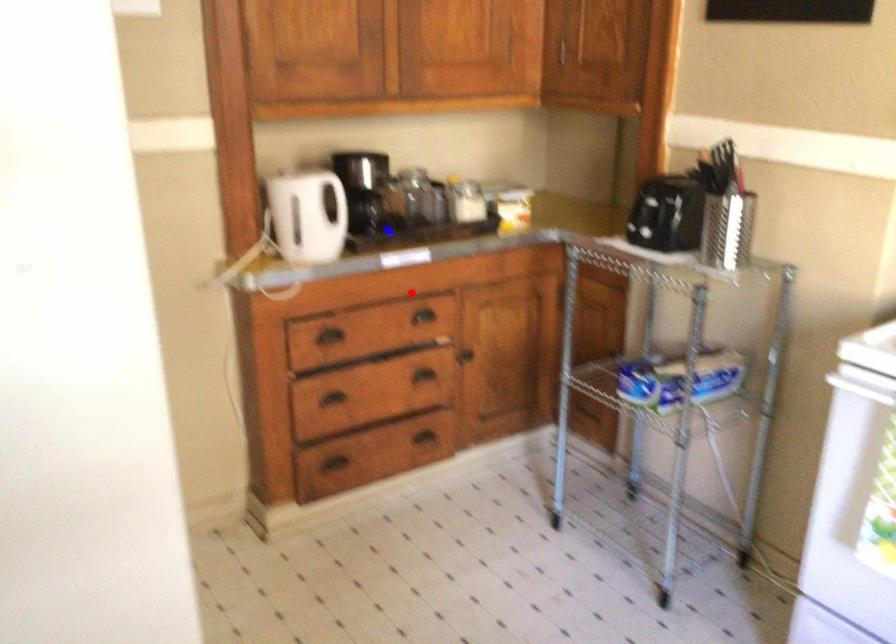
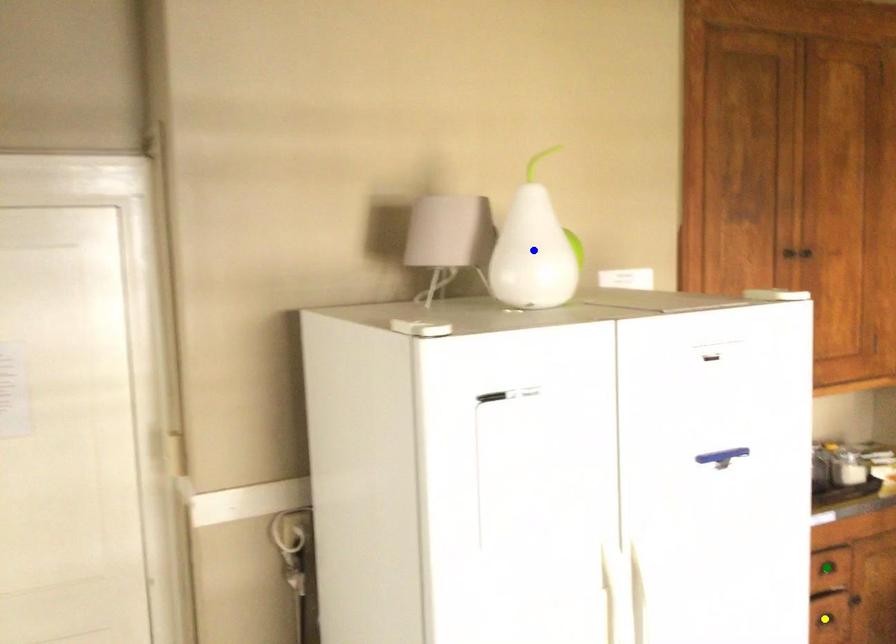
Question: I am providing you with two images of the same scene from different viewpoints. A red point is marked on the first image. You are given multiple points on the second image. Which point in image 2 represents the same 3d spot as the red point in image 1?

Choices:
 (A) green point
 (B) blue point
 (C) yellow point

Answer: (A)